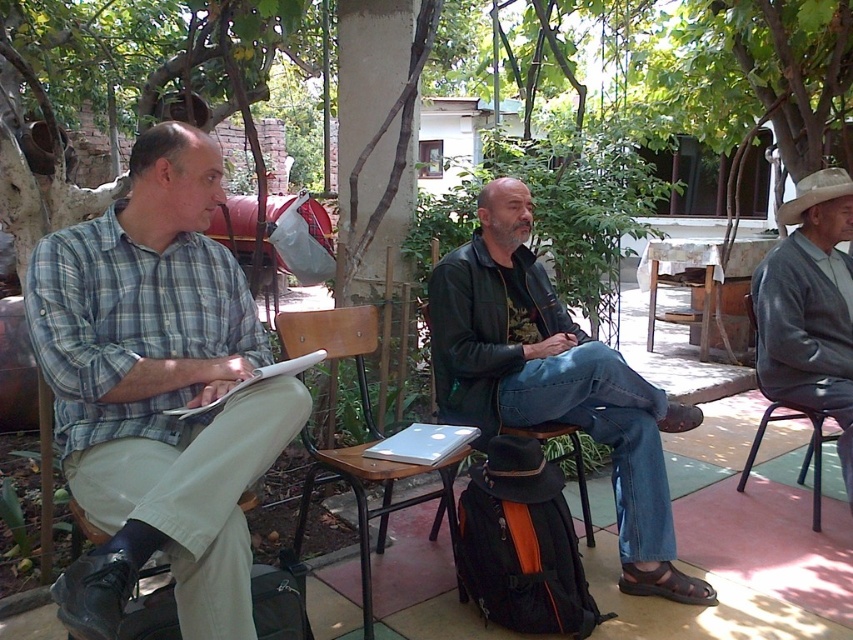
Question: In this image, where is plaid cotton shirt at left located relative to white cloth-covered table at center?

Choices:
 (A) above
 (B) below

Answer: (B)

Question: Can you confirm if gray woolen sweater at right is positioned to the left of brown wooden chair at center?

Choices:
 (A) yes
 (B) no

Answer: (B)

Question: Is white cloth-covered table at center wider than brown felt cowboy hat at upper right?

Choices:
 (A) yes
 (B) no

Answer: (A)

Question: Estimate the real-world distances between objects in this image. Which object is closer to the white cloth-covered table at center?

Choices:
 (A) plaid cotton shirt at left
 (B) leather jacket at center

Answer: (B)

Question: Which point is closer to the camera?

Choices:
 (A) brown felt cowboy hat at upper right
 (B) brown wooden chair at center
 (C) plaid cotton shirt at left
 (D) white cloth-covered table at center

Answer: (C)

Question: Which point appears closest to the camera in this image?

Choices:
 (A) (781, 218)
 (B) (630, 460)
 (C) (198, 342)

Answer: (C)